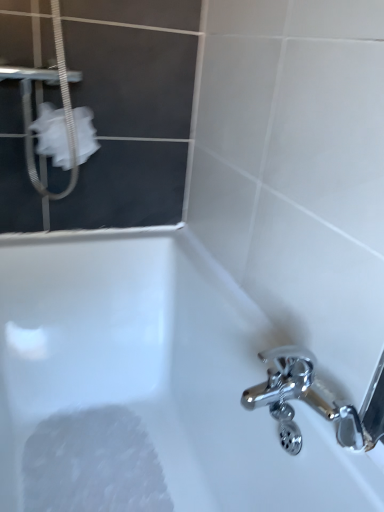
You are a GUI agent. You are given a task and a screenshot of the screen. Output one action in this format:
    pyautogui.click(x=<x>, y=<y>)
    Task: Click on the white fabric screen door at upper left
    Image resolution: width=384 pixels, height=512 pixels.
    Given the screenshot: What is the action you would take?
    pyautogui.click(x=131, y=109)

Measure the distance between point (79,291) and camera.

1.30 meters.

The image size is (384, 512). Find the location of `white fabric at upper left`. white fabric at upper left is located at coordinates (52, 135).

Does white glossy bathtub at lower left touch white foamy at bottom left?

No, white glossy bathtub at lower left is not in contact with white foamy at bottom left.

Which is correct: white glossy bathtub at lower left is inside white foamy at bottom left, or outside of it?

white glossy bathtub at lower left cannot be found inside white foamy at bottom left.

Is white glossy bathtub at lower left thinner than white foamy at bottom left?

In fact, white glossy bathtub at lower left might be wider than white foamy at bottom left.

Consider the image. Which is closer, (50, 312) or (100, 409)?

Point (50, 312) is closer to the camera than point (100, 409).

Find the location of a particular element. toilet paper above the white glossy bathtub at lower left (from a real-world perspective) is located at coordinates (52, 135).

Would you say white fabric at upper left is to the left or to the right of white glossy bathtub at lower left in the picture?

white fabric at upper left is positioned on white glossy bathtub at lower left's left side.

In the scene shown: Can you tell me how much white fabric at upper left and white glossy bathtub at lower left differ in facing direction?

There is a 87.9-degree angle between the facing directions of white fabric at upper left and white glossy bathtub at lower left.

Which is in front, white fabric at upper left or white glossy bathtub at lower left?

white glossy bathtub at lower left is closer to the camera.

Does point (73, 423) appear closer or farther from the camera than point (128, 297)?

Point (73, 423) is closer to the camera than point (128, 297).

Between white foamy at bottom left and white glossy bathtub at lower left, which one has larger width?

Wider between the two is white glossy bathtub at lower left.

Would you consider white foamy at bottom left to be distant from white glossy bathtub at lower left?

No, white foamy at bottom left is in close proximity to white glossy bathtub at lower left.

What's the angular difference between white fabric screen door at upper left and white glossy bathtub at lower left's facing directions?

91.2 degrees separate the facing orientations of white fabric screen door at upper left and white glossy bathtub at lower left.

Is white glossy bathtub at lower left at the back of white fabric screen door at upper left?

No, white fabric screen door at upper left is not facing away from white glossy bathtub at lower left.

From a real-world perspective, is white fabric screen door at upper left positioned above or below white glossy bathtub at lower left?

From a real-world perspective, white fabric screen door at upper left is physically above white glossy bathtub at lower left.

Is white foamy at bottom left next to white fabric screen door at upper left?

No.

Is white foamy at bottom left situated inside white fabric screen door at upper left or outside?

white foamy at bottom left is not enclosed by white fabric screen door at upper left.

The width and height of the screenshot is (384, 512). Identify the location of foam that appears below the white fabric screen door at upper left (from a real-world perspective). (93, 464).

Which object is positioned more to the right, white fabric screen door at upper left or white fabric at upper left?

white fabric screen door at upper left.

From a real-world perspective, who is located lower, white fabric screen door at upper left or white fabric at upper left?

white fabric at upper left is physically lower.

Looking at this image, is white fabric screen door at upper left spatially inside white fabric at upper left, or outside of it?

white fabric screen door at upper left is outside white fabric at upper left.

Are white fabric screen door at upper left and white fabric at upper left beside each other?

There is a gap between white fabric screen door at upper left and white fabric at upper left.

Is white fabric at upper left oriented away from white fabric screen door at upper left?

Correct, white fabric at upper left is looking away from white fabric screen door at upper left.

In the image, is white fabric at upper left positioned in front of or behind white fabric screen door at upper left?

Clearly, white fabric at upper left is behind white fabric screen door at upper left.

What's the angular difference between white fabric at upper left and white fabric screen door at upper left's facing directions?

The angular difference between white fabric at upper left and white fabric screen door at upper left is 3.28 degrees.

Is white fabric at upper left in contact with white fabric screen door at upper left?

white fabric at upper left and white fabric screen door at upper left are clearly separated.

I want to click on bathtub above the white foamy at bottom left (from the image's perspective), so click(x=160, y=372).

Locate an element on the screen. bathtub located on the right of white fabric at upper left is located at coordinates click(x=160, y=372).

Looking at the image, which one is located further to white foamy at bottom left, white fabric at upper left or white glossy bathtub at lower left?

white fabric at upper left is further to white foamy at bottom left.

From the picture: Based on their spatial positions, is white glossy bathtub at lower left or white foamy at bottom left closer to white fabric at upper left?

white glossy bathtub at lower left is closer to white fabric at upper left.

Which object lies nearer to the anchor point white glossy bathtub at lower left, white fabric at upper left or white foamy at bottom left?

The object closer to white glossy bathtub at lower left is white foamy at bottom left.

When comparing their distances from white fabric at upper left, does white glossy bathtub at lower left or white fabric screen door at upper left seem further?

Based on the image, white glossy bathtub at lower left appears to be further to white fabric at upper left.

From the image, which object appears to be nearer to white fabric at upper left, white fabric screen door at upper left or white foamy at bottom left?

white fabric screen door at upper left.

From the image, which object appears to be farther from white foamy at bottom left, white glossy bathtub at lower left or white fabric screen door at upper left?

white fabric screen door at upper left lies further to white foamy at bottom left than the other object.

Estimate the real-world distances between objects in this image. Which object is closer to white fabric screen door at upper left, white fabric at upper left or white glossy bathtub at lower left?

Among the two, white fabric at upper left is located nearer to white fabric screen door at upper left.

Based on their spatial positions, is white fabric at upper left or white foamy at bottom left closer to white fabric screen door at upper left?

white fabric at upper left.

Identify the location of bathtub between white fabric screen door at upper left and white foamy at bottom left in the up-down direction. Image resolution: width=384 pixels, height=512 pixels. (160, 372).

The height and width of the screenshot is (512, 384). Find the location of `toilet paper between white fabric screen door at upper left and white foamy at bottom left in the vertical direction`. toilet paper between white fabric screen door at upper left and white foamy at bottom left in the vertical direction is located at coordinates (52, 135).

Locate an element on the screen. This screenshot has width=384, height=512. toilet paper between white fabric screen door at upper left and white glossy bathtub at lower left from top to bottom is located at coordinates (52, 135).

Find the location of a particular element. Image resolution: width=384 pixels, height=512 pixels. bathtub between white fabric at upper left and white foamy at bottom left in the up-down direction is located at coordinates (160, 372).